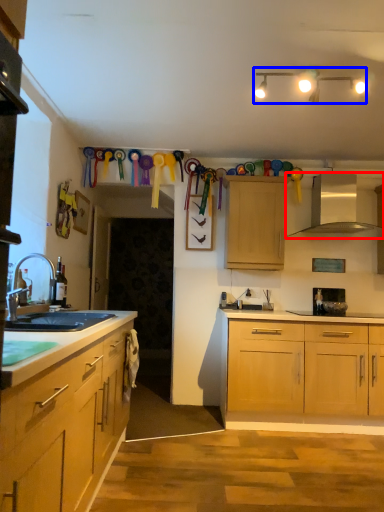
Question: Which point is further to the camera, exhaust hood (highlighted by a red box) or lamp (highlighted by a blue box)?

Choices:
 (A) exhaust hood
 (B) lamp

Answer: (A)